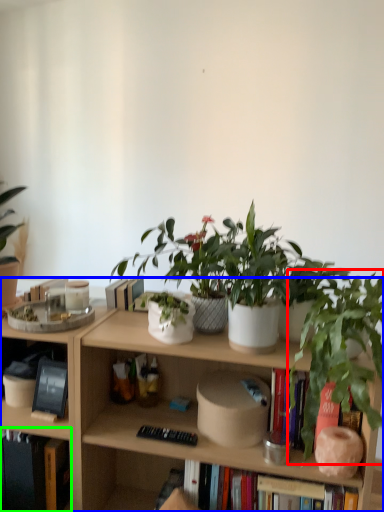
Question: Which is farther away from houseplant (highlighted by a red box)? bookcase (highlighted by a blue box) or book (highlighted by a green box)?

Choices:
 (A) bookcase
 (B) book

Answer: (B)